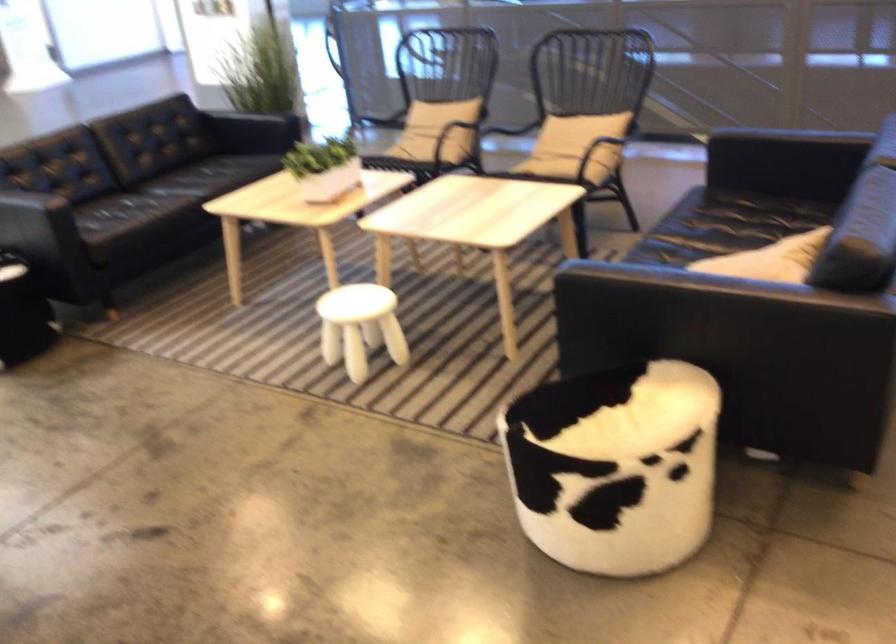
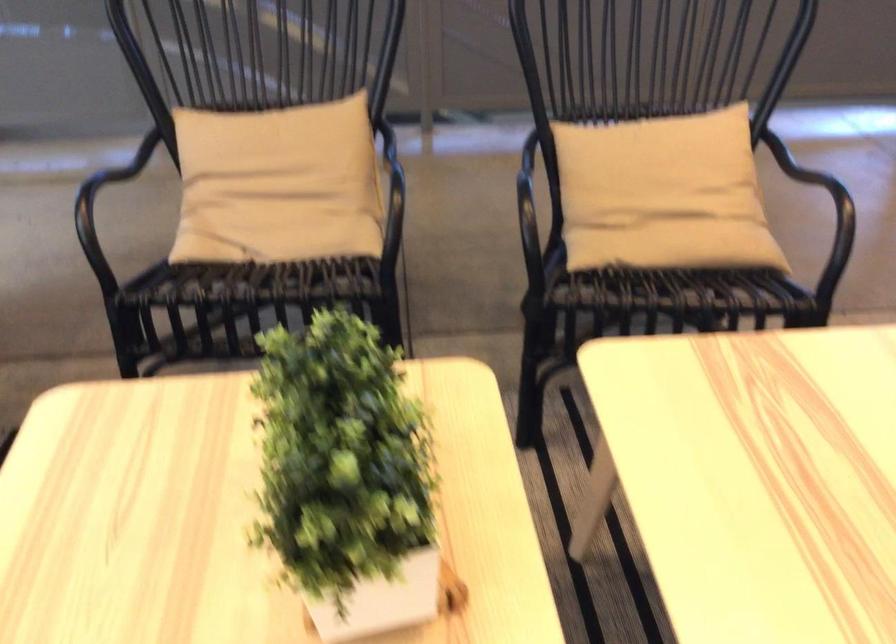
In the second image, find the point that corresponds to point (391, 153) in the first image.

(268, 267)